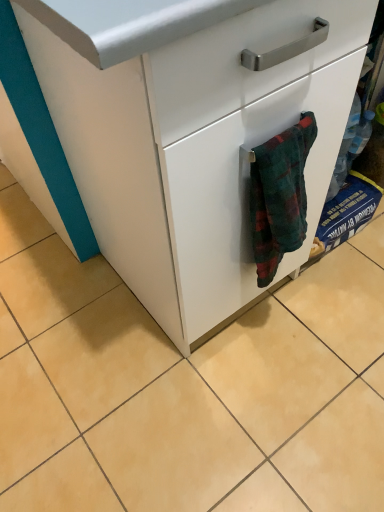
The width and height of the screenshot is (384, 512). What do you see at coordinates (279, 196) in the screenshot?
I see `flannel bath towel at lower right` at bounding box center [279, 196].

Identify the location of flannel bath towel at lower right. (279, 196).

Find the location of a particular element. The width and height of the screenshot is (384, 512). white matte cabinet at center is located at coordinates (197, 142).

What do you see at coordinates (197, 142) in the screenshot?
I see `white matte cabinet at center` at bounding box center [197, 142].

What is the approximate width of white matte cabinet at center?

white matte cabinet at center is 52.63 centimeters wide.

Where is `flannel bath towel at lower right`? flannel bath towel at lower right is located at coordinates (279, 196).

Which is more to the right, white matte cabinet at center or flannel bath towel at lower right?

Positioned to the right is white matte cabinet at center.

Is white matte cabinet at center further to the viewer compared to flannel bath towel at lower right?

No, it is not.

Is point (310, 45) closer to viewer compared to point (257, 247)?

Yes, point (310, 45) is closer to viewer.

From the image's perspective, who appears lower, white matte cabinet at center or flannel bath towel at lower right?

From the image's view, flannel bath towel at lower right is below.

From a real-world perspective, is white matte cabinet at center under flannel bath towel at lower right?

Yes, from a real-world perspective, white matte cabinet at center is below flannel bath towel at lower right.

Considering the relative sizes of white matte cabinet at center and flannel bath towel at lower right in the image provided, is white matte cabinet at center wider than flannel bath towel at lower right?

Yes, white matte cabinet at center is wider than flannel bath towel at lower right.

Considering the relative sizes of white matte cabinet at center and flannel bath towel at lower right in the image provided, is white matte cabinet at center taller than flannel bath towel at lower right?

Correct, white matte cabinet at center is much taller as flannel bath towel at lower right.

Who is bigger, white matte cabinet at center or flannel bath towel at lower right?

white matte cabinet at center is bigger.

Is white matte cabinet at center spatially inside flannel bath towel at lower right, or outside of it?

white matte cabinet at center lies outside flannel bath towel at lower right.

Is there a large distance between white matte cabinet at center and flannel bath towel at lower right?

white matte cabinet at center is actually quite close to flannel bath towel at lower right.

Is white matte cabinet at center aimed at flannel bath towel at lower right?

Yes, white matte cabinet at center is turned towards flannel bath towel at lower right.

Image resolution: width=384 pixels, height=512 pixels. Identify the location of bath towel behind the white matte cabinet at center. (279, 196).

Does flannel bath towel at lower right appear on the left side of white matte cabinet at center?

Correct, you'll find flannel bath towel at lower right to the left of white matte cabinet at center.

Which object is closer to the camera, flannel bath towel at lower right or white matte cabinet at center?

white matte cabinet at center is more forward.

Considering the points (285, 158) and (225, 122), which point is behind, point (285, 158) or point (225, 122)?

The point (285, 158) is farther.

From the image's perspective, which is below, flannel bath towel at lower right or white matte cabinet at center?

flannel bath towel at lower right appears lower in the image.

Consider the image. From a real-world perspective, is flannel bath towel at lower right positioned above or below white matte cabinet at center?

flannel bath towel at lower right is situated higher than white matte cabinet at center in the real world.

Can you confirm if flannel bath towel at lower right is thinner than white matte cabinet at center?

Yes.

Considering the relative sizes of flannel bath towel at lower right and white matte cabinet at center in the image provided, is flannel bath towel at lower right taller than white matte cabinet at center?

No, flannel bath towel at lower right is not taller than white matte cabinet at center.

Is flannel bath towel at lower right bigger than white matte cabinet at center?

Incorrect, flannel bath towel at lower right is not larger than white matte cabinet at center.

Is flannel bath towel at lower right positioned beyond the bounds of white matte cabinet at center?

That's incorrect, flannel bath towel at lower right is not completely outside white matte cabinet at center.

Is flannel bath towel at lower right positioned far away from white matte cabinet at center?

That's not correct — flannel bath towel at lower right is a little close to white matte cabinet at center.

Is flannel bath towel at lower right aimed at white matte cabinet at center?

No, flannel bath towel at lower right does not turn towards white matte cabinet at center.

In the image, there is a flannel bath towel at lower right. At what (x,y) coordinates should I click in order to perform the action: click on the chest of drawers below it (from a real-world perspective). Please return your answer as a coordinate pair (x, y). Image resolution: width=384 pixels, height=512 pixels. Looking at the image, I should click on tap(197, 142).

This screenshot has width=384, height=512. Find the location of `chest of drawers below the flannel bath towel at lower right (from a real-world perspective)`. chest of drawers below the flannel bath towel at lower right (from a real-world perspective) is located at coordinates (197, 142).

Locate an element on the screen. The height and width of the screenshot is (512, 384). bath towel on the left of white matte cabinet at center is located at coordinates (279, 196).